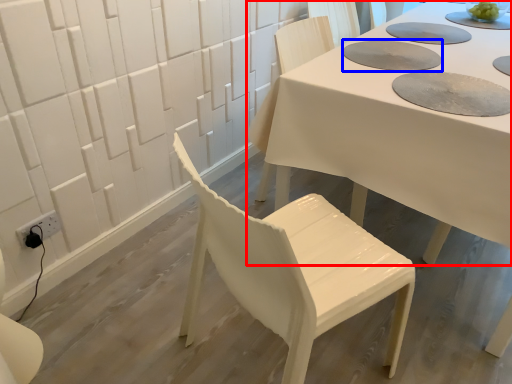
Question: Among these objects, which one is farthest to the camera, table (highlighted by a red box) or paper plate (highlighted by a blue box)?

Choices:
 (A) table
 (B) paper plate

Answer: (B)